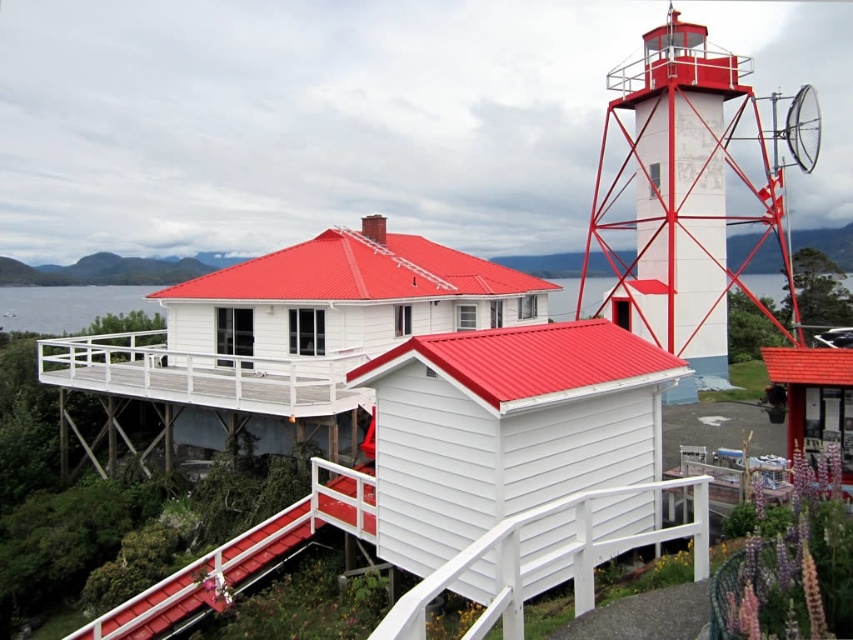
Consider the image. Measure the distance between point (x=750, y=97) and camera.

Point (x=750, y=97) and camera are 28.69 meters apart from each other.

Is white painted metal tower at upper right wider than white painted wood at lower center?

Indeed, white painted metal tower at upper right has a greater width compared to white painted wood at lower center.

At what (x,y) coordinates should I click in order to perform the action: click on white painted metal tower at upper right. Please return your answer as a coordinate pair (x, y). The image size is (853, 640). Looking at the image, I should click on (689, 193).

Which of these two, white painted metal tower at upper right or smooth wood handrail at center, stands taller?

With more height is white painted metal tower at upper right.

Can you confirm if white painted metal tower at upper right is taller than smooth wood handrail at center?

Yes.

Does point (811, 134) come in front of point (209, 609)?

No, (811, 134) is behind (209, 609).

Where is `white painted metal tower at upper right`? This screenshot has height=640, width=853. white painted metal tower at upper right is located at coordinates (689, 193).

Between smooth wood handrail at center and white painted wood at lower center, which one appears on the right side from the viewer's perspective?

white painted wood at lower center

Who is taller, smooth wood handrail at center or white painted wood at lower center?

smooth wood handrail at center is taller.

Locate an element on the screen. This screenshot has width=853, height=640. smooth wood handrail at center is located at coordinates (242, 557).

The height and width of the screenshot is (640, 853). In order to click on smooth wood handrail at center in this screenshot , I will do `click(242, 557)`.